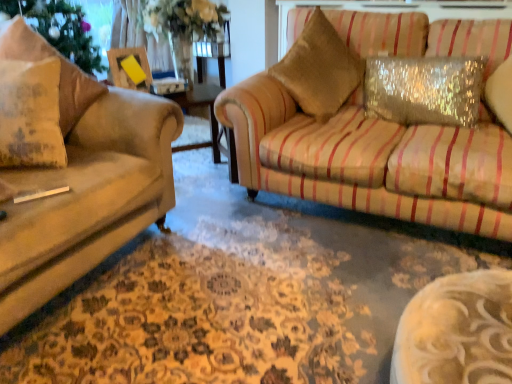
Question: Is textured beige pillow at left, the 2th pillow positioned from the left, wider or thinner than matte beige pillow at left, the third pillow in the right-to-left sequence?

Choices:
 (A) wide
 (B) thin

Answer: (A)

Question: From a real-world perspective, is textured beige pillow at left, which is the second pillow in right-to-left order, physically located above or below matte beige pillow at left, the third pillow in the right-to-left sequence?

Choices:
 (A) below
 (B) above

Answer: (B)

Question: Based on their relative distances, which object is nearer to the textured beige pillow at left, which is the second pillow in right-to-left order?

Choices:
 (A) matte beige pillow at left, the third pillow in the right-to-left sequence
 (B) sparkly silver pillow at upper right, placed as the 3th pillow when sorted from left to right
 (C) gold textured pillow at upper right

Answer: (A)

Question: Based on their relative distances, which object is farther from the sparkly silver pillow at upper right, placed as the 3th pillow when sorted from left to right?

Choices:
 (A) textured beige pillow at left, the 2th pillow positioned from the left
 (B) gold textured pillow at upper right
 (C) matte beige pillow at left, the 1th pillow viewed from the left

Answer: (C)